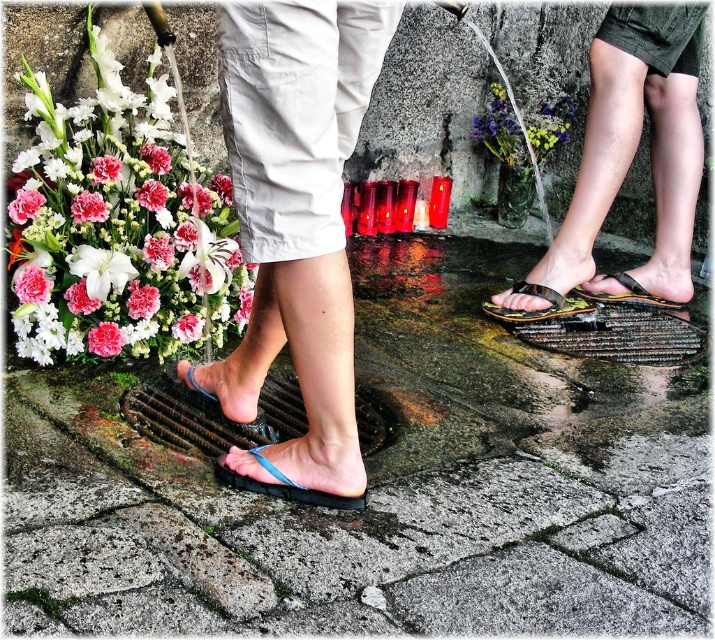
Which of these two, black rubber sandals at lower right or white matte carnation at lower left, stands shorter?

Standing shorter between the two is white matte carnation at lower left.

Is black rubber sandals at lower right to the right of white matte carnation at lower left from the viewer's perspective?

Indeed, black rubber sandals at lower right is positioned on the right side of white matte carnation at lower left.

Which is behind, point (628, 291) or point (117, 352)?

Positioned behind is point (628, 291).

Locate an element on the screen. black rubber sandals at lower right is located at coordinates (626, 292).

Can you confirm if black textured sandals at lower right is smaller than black rubber flip-flop at lower left?

No.

From the picture: Can you confirm if black textured sandals at lower right is shorter than black rubber flip-flop at lower left?

No.

Does point (633, 122) lie in front of point (310, 490)?

No.

In order to click on black textured sandals at lower right in this screenshot , I will do `click(628, 163)`.

Does black rubber flip-flop at lower left appear over white matte carnation at lower left?

No, black rubber flip-flop at lower left is not above white matte carnation at lower left.

Is point (255, 483) more distant than point (112, 324)?

No, (255, 483) is in front of (112, 324).

Locate an element on the screen. The image size is (715, 640). black rubber flip-flop at lower left is located at coordinates (286, 484).